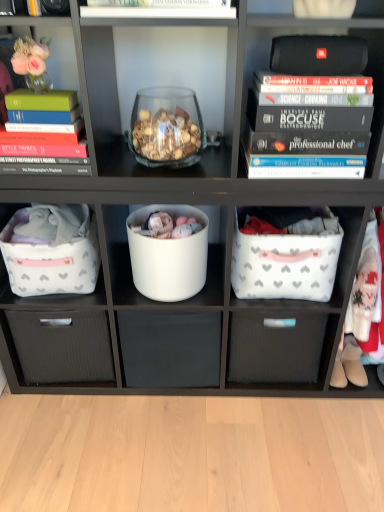
Question: Is white matte drawer at center, the first drawer when ordered from left to right, smaller than black matte speaker at upper right?

Choices:
 (A) yes
 (B) no

Answer: (B)

Question: From the image's perspective, is white matte drawer at center, placed as the 2th drawer when sorted from right to left, under black matte speaker at upper right?

Choices:
 (A) no
 (B) yes

Answer: (B)

Question: Is white matte drawer at center, the first drawer when ordered from left to right, to the right of black matte speaker at upper right from the viewer's perspective?

Choices:
 (A) yes
 (B) no

Answer: (B)

Question: Considering the relative positions of white matte drawer at center, placed as the 2th drawer when sorted from right to left, and black matte speaker at upper right in the image provided, is white matte drawer at center, placed as the 2th drawer when sorted from right to left, to the left of black matte speaker at upper right from the viewer's perspective?

Choices:
 (A) no
 (B) yes

Answer: (B)

Question: From a real-world perspective, is white matte drawer at center, the first drawer when ordered from left to right, positioned under black matte speaker at upper right based on gravity?

Choices:
 (A) no
 (B) yes

Answer: (B)

Question: Is white matte drawer at center, placed as the 2th drawer when sorted from right to left, positioned behind black matte speaker at upper right?

Choices:
 (A) yes
 (B) no

Answer: (A)

Question: Considering the relative sizes of translucent glass bowl at center and black matte speaker at upper right in the image provided, is translucent glass bowl at center taller than black matte speaker at upper right?

Choices:
 (A) yes
 (B) no

Answer: (A)

Question: Is translucent glass bowl at center to the left of black matte speaker at upper right from the viewer's perspective?

Choices:
 (A) no
 (B) yes

Answer: (B)

Question: Is translucent glass bowl at center positioned with its back to black matte speaker at upper right?

Choices:
 (A) no
 (B) yes

Answer: (A)

Question: Does translucent glass bowl at center contain black matte speaker at upper right?

Choices:
 (A) yes
 (B) no

Answer: (B)

Question: Does translucent glass bowl at center have a larger size compared to black matte speaker at upper right?

Choices:
 (A) no
 (B) yes

Answer: (B)

Question: Is translucent glass bowl at center not within black matte speaker at upper right?

Choices:
 (A) yes
 (B) no

Answer: (A)

Question: Is black matte speaker at upper right taller than white matte bucket at center?

Choices:
 (A) yes
 (B) no

Answer: (B)